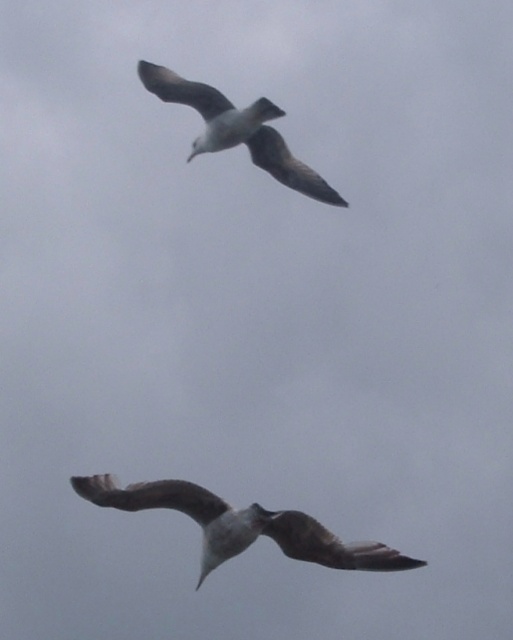
Does brown feathered bird at center have a smaller size compared to white feathered bird at upper center?

No, brown feathered bird at center is not smaller than white feathered bird at upper center.

At what (x,y) coordinates should I click in order to perform the action: click on brown feathered bird at center. Please return your answer as a coordinate pair (x, y). Image resolution: width=513 pixels, height=640 pixels. Looking at the image, I should click on (243, 525).

Between point (349, 545) and point (155, 68), which one is positioned behind?

Point (155, 68)

The image size is (513, 640). Identify the location of brown feathered bird at center. (243, 525).